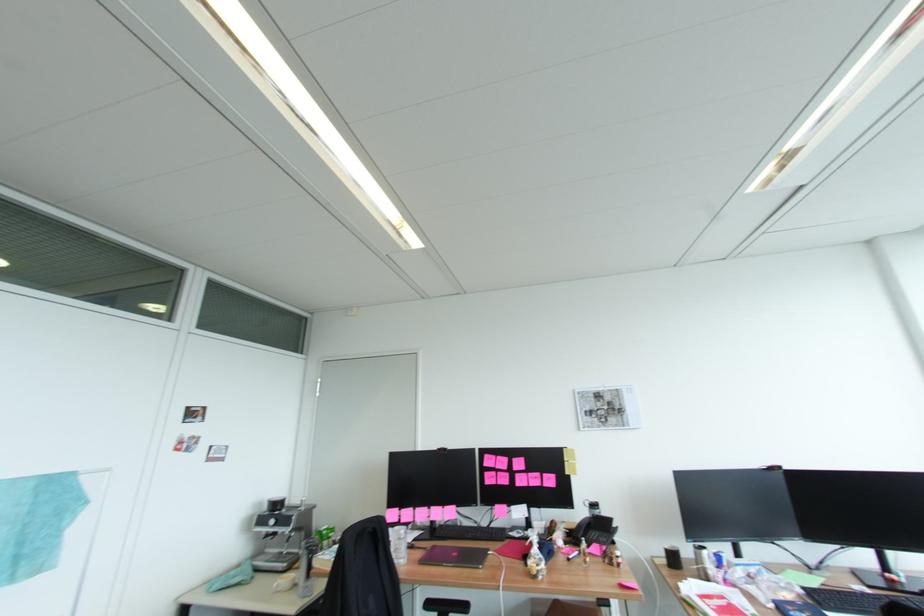
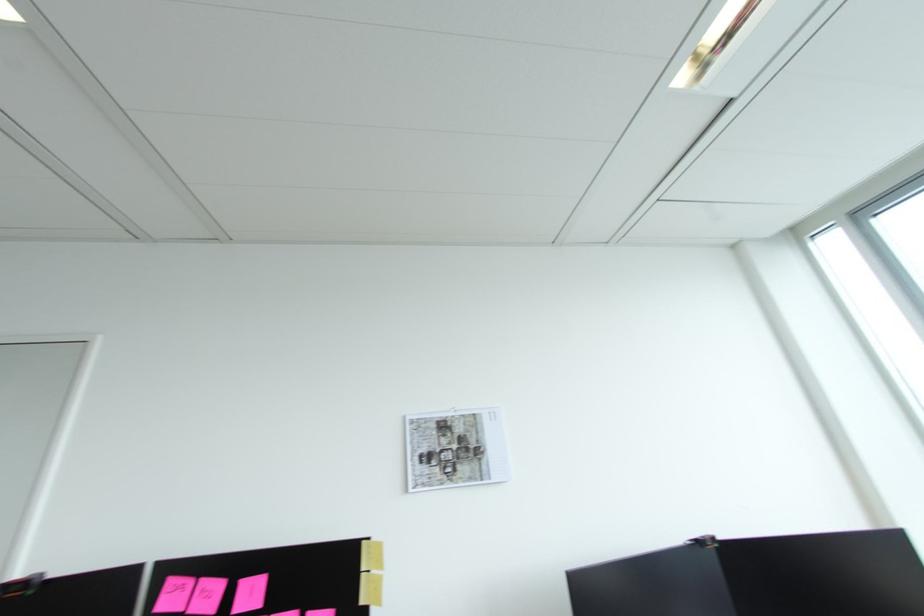
Locate, in the second image, the point that corresponds to the point at 492,456 in the first image.

(176, 582)